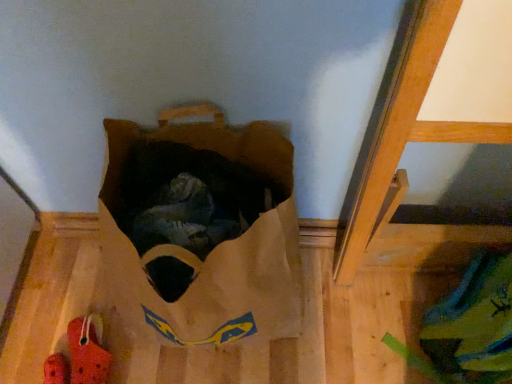
Where is `rubber/crocodile at lower left`? The image size is (512, 384). rubber/crocodile at lower left is located at coordinates (87, 351).

The width and height of the screenshot is (512, 384). What do you see at coordinates (87, 351) in the screenshot?
I see `rubber/crocodile at lower left` at bounding box center [87, 351].

Measure the distance between brown paper bag at upper center and camera.

A distance of 22.41 inches exists between brown paper bag at upper center and camera.

Locate an element on the screen. brown paper bag at upper center is located at coordinates [x=201, y=229].

The height and width of the screenshot is (384, 512). What do you see at coordinates (201, 229) in the screenshot?
I see `brown paper bag at upper center` at bounding box center [201, 229].

The height and width of the screenshot is (384, 512). What are the coordinates of `rubber/crocodile at lower left` in the screenshot? It's located at 87,351.

Is brown paper bag at upper center at the left side of rubber/crocodile at lower left?

No.

Which object is further away from the camera, brown paper bag at upper center or rubber/crocodile at lower left?

rubber/crocodile at lower left is further from the camera.

Does point (283, 293) lie behind point (100, 364)?

That is False.

From the image's perspective, is brown paper bag at upper center over rubber/crocodile at lower left?

Yes, from the image's perspective, brown paper bag at upper center is above rubber/crocodile at lower left.

From a real-world perspective, which object rests below the other?

rubber/crocodile at lower left, from a real-world perspective.

Between brown paper bag at upper center and rubber/crocodile at lower left, which one has smaller width?

rubber/crocodile at lower left is thinner.

Is brown paper bag at upper center taller than rubber/crocodile at lower left?

Yes.

Looking at the image, does brown paper bag at upper center seem bigger or smaller compared to rubber/crocodile at lower left?

Considering their sizes, brown paper bag at upper center takes up more space than rubber/crocodile at lower left.

Is brown paper bag at upper center not within rubber/crocodile at lower left?

brown paper bag at upper center is positioned outside rubber/crocodile at lower left.

Is brown paper bag at upper center beside rubber/crocodile at lower left?

They are not placed beside each other.

Could you tell me if brown paper bag at upper center is turned towards rubber/crocodile at lower left?

No, brown paper bag at upper center is not facing towards rubber/crocodile at lower left.

How different are the orientations of brown paper bag at upper center and rubber/crocodile at lower left in degrees?

The angle between the facing direction of brown paper bag at upper center and the facing direction of rubber/crocodile at lower left is 25.6 degrees.

At what (x,y) coordinates should I click in order to perform the action: click on grocery bag in front of the rubber/crocodile at lower left. Please return your answer as a coordinate pair (x, y). The image size is (512, 384). Looking at the image, I should click on (201, 229).

Between rubber/crocodile at lower left and brown paper bag at upper center, which one appears on the left side from the viewer's perspective?

rubber/crocodile at lower left is more to the left.

In the scene shown: Is the position of rubber/crocodile at lower left less distant than that of brown paper bag at upper center?

No, the depth of rubber/crocodile at lower left is greater than that of brown paper bag at upper center.

Does point (71, 360) appear closer or farther from the camera than point (284, 224)?

Point (71, 360).

From the image's perspective, is rubber/crocodile at lower left located above or below brown paper bag at upper center?

Based on their image positions, rubber/crocodile at lower left is located beneath brown paper bag at upper center.

From a real-world perspective, between rubber/crocodile at lower left and brown paper bag at upper center, who is vertically higher?

brown paper bag at upper center.

Considering the relative sizes of rubber/crocodile at lower left and brown paper bag at upper center in the image provided, is rubber/crocodile at lower left thinner than brown paper bag at upper center?

Yes, rubber/crocodile at lower left is thinner than brown paper bag at upper center.

Consider the image. From their relative heights in the image, would you say rubber/crocodile at lower left is taller or shorter than brown paper bag at upper center?

rubber/crocodile at lower left is shorter than brown paper bag at upper center.

Considering the relative sizes of rubber/crocodile at lower left and brown paper bag at upper center in the image provided, is rubber/crocodile at lower left smaller than brown paper bag at upper center?

Correct, rubber/crocodile at lower left occupies less space than brown paper bag at upper center.

Is rubber/crocodile at lower left inside the boundaries of brown paper bag at upper center, or outside?

rubber/crocodile at lower left is not enclosed by brown paper bag at upper center.

Looking at this image, are rubber/crocodile at lower left and brown paper bag at upper center making contact?

rubber/crocodile at lower left and brown paper bag at upper center are clearly separated.

Could you tell me if rubber/crocodile at lower left is turned towards brown paper bag at upper center?

No, rubber/crocodile at lower left does not turn towards brown paper bag at upper center.

How many degrees apart are the facing directions of rubber/crocodile at lower left and brown paper bag at upper center?

There is a 25.6-degree angle between the facing directions of rubber/crocodile at lower left and brown paper bag at upper center.

I want to click on footwear that is under the brown paper bag at upper center (from a real-world perspective), so click(x=87, y=351).

Find the location of `grocery bag in front of the rubber/crocodile at lower left`. grocery bag in front of the rubber/crocodile at lower left is located at coordinates (201, 229).

The image size is (512, 384). I want to click on footwear behind the brown paper bag at upper center, so click(87, 351).